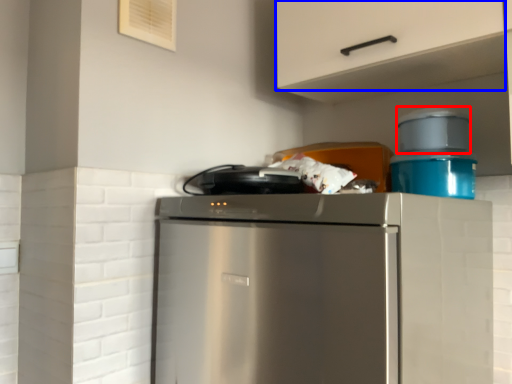
Question: Which of the following is the closest to the observer, appliance (highlighted by a red box) or cabinetry (highlighted by a blue box)?

Choices:
 (A) appliance
 (B) cabinetry

Answer: (B)